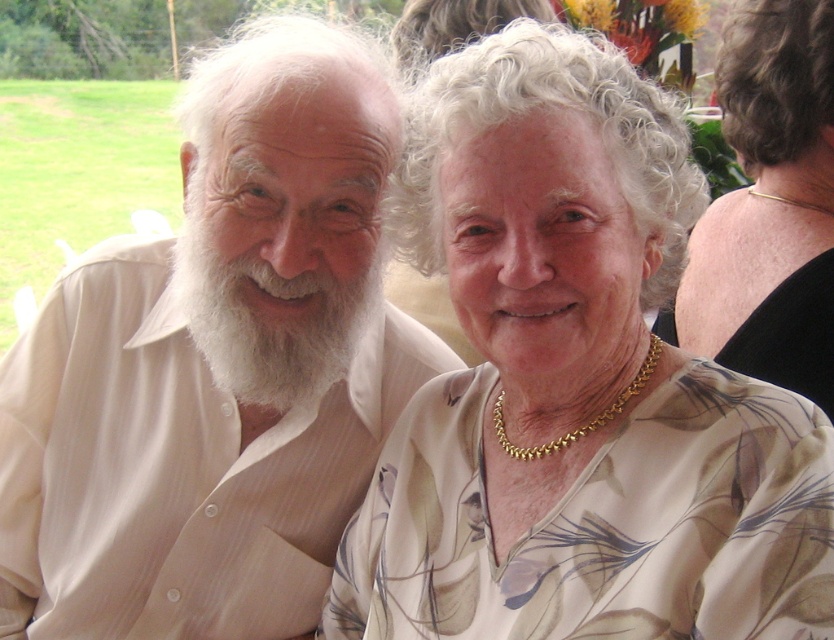
Question: Among these objects, which one is nearest to the camera?

Choices:
 (A) white floral blouse at center
 (B) white fluffy beard at left
 (C) gold necklace at upper right
 (D) light beige shirt at left

Answer: (A)

Question: Is gold necklace at upper right in front of white fluffy beard at left?

Choices:
 (A) yes
 (B) no

Answer: (B)

Question: Is the position of white floral blouse at center more distant than that of white fluffy beard at left?

Choices:
 (A) no
 (B) yes

Answer: (A)

Question: Which of the following is the farthest from the observer?

Choices:
 (A) (220, 444)
 (B) (791, 412)
 (C) (234, 394)
 (D) (787, 176)

Answer: (D)

Question: Which point appears farthest from the camera in this image?

Choices:
 (A) (74, 532)
 (B) (770, 177)

Answer: (B)

Question: Is white floral blouse at center further to camera compared to gold necklace at upper right?

Choices:
 (A) yes
 (B) no

Answer: (B)